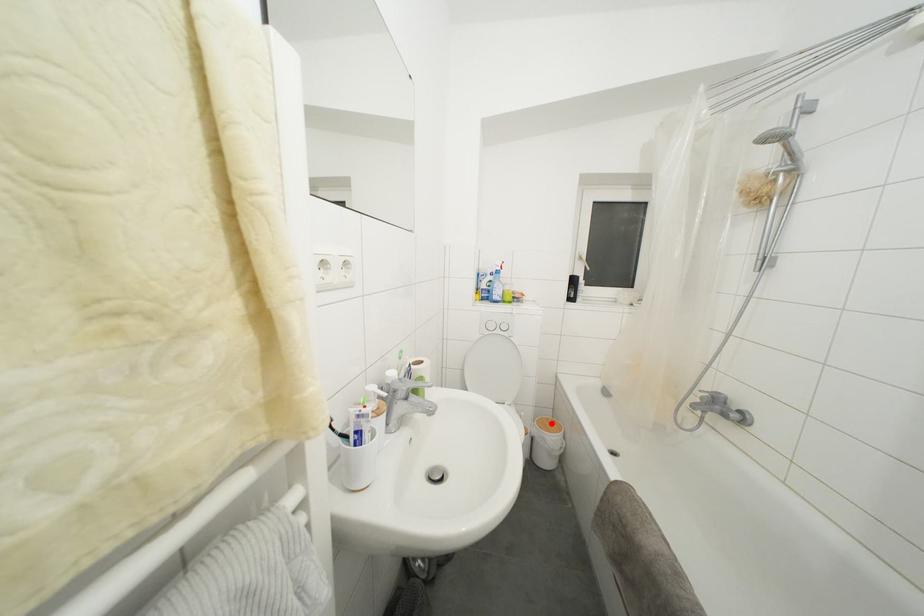
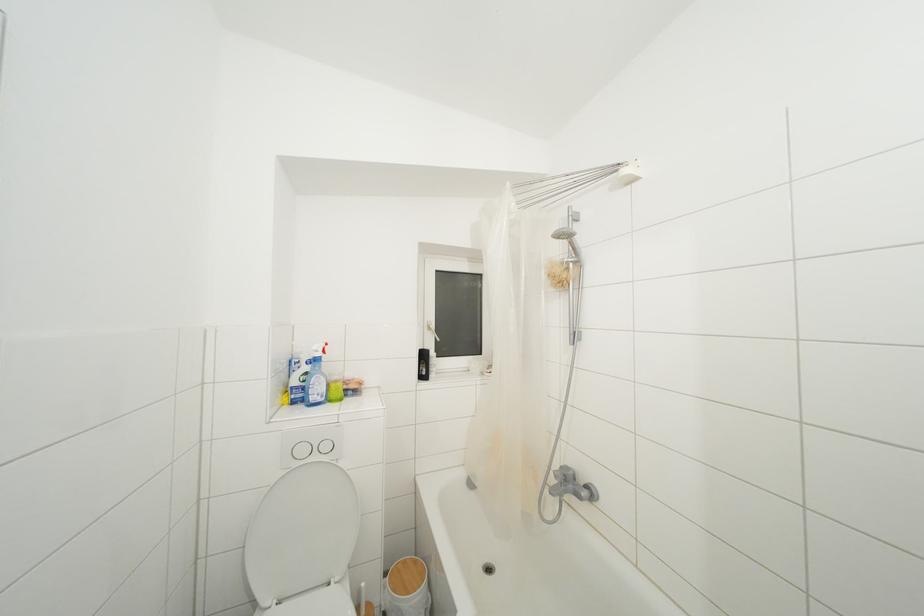
Question: I am providing you with two images of the same scene from different viewpoints. Given a red point in image1, look at the same physical point in image2. Is it:

Choices:
 (A) Closer to the viewpoint
 (B) Farther from the viewpoint

Answer: (A)